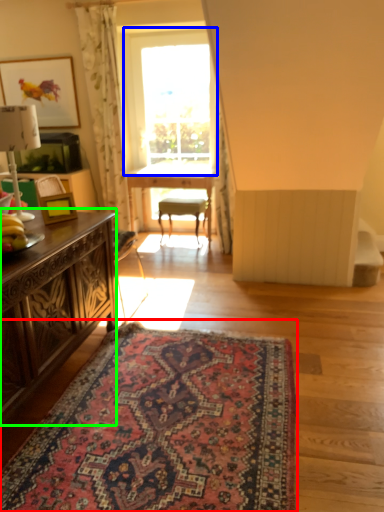
Question: Considering the real-world distances, which object is closest to mat (highlighted by a red box)? window (highlighted by a blue box) or desk (highlighted by a green box).

Choices:
 (A) window
 (B) desk

Answer: (B)